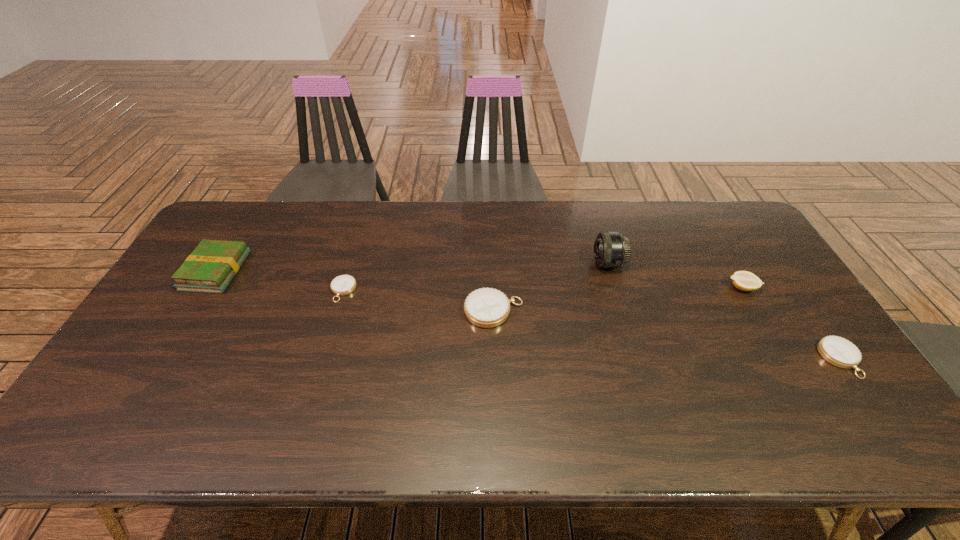
The width and height of the screenshot is (960, 540). I want to click on object located in the near edge section of the desktop, so click(x=838, y=351).

The height and width of the screenshot is (540, 960). In order to click on object that is at the left edge in this screenshot , I will do [210, 268].

Where is `compass positioned at the right edge`? The width and height of the screenshot is (960, 540). compass positioned at the right edge is located at coordinates (838, 351).

Locate an element on the screen. lemon that is at the right edge is located at coordinates click(743, 280).

This screenshot has height=540, width=960. Identify the location of object that is at the near right corner. (838, 351).

Where is `vacant space at the far edge of the desktop`? vacant space at the far edge of the desktop is located at coordinates (372, 202).

Locate an element on the screen. vacant space at the near edge of the desktop is located at coordinates (423, 393).

Find the location of a particular element. The height and width of the screenshot is (540, 960). vacant space at the left edge of the desktop is located at coordinates (188, 310).

At what (x,y) coordinates should I click in order to perform the action: click on free region at the far left corner of the desktop. Please return your answer as a coordinate pair (x, y). The width and height of the screenshot is (960, 540). Looking at the image, I should click on (264, 203).

This screenshot has height=540, width=960. I want to click on vacant space at the near left corner of the desktop, so click(156, 397).